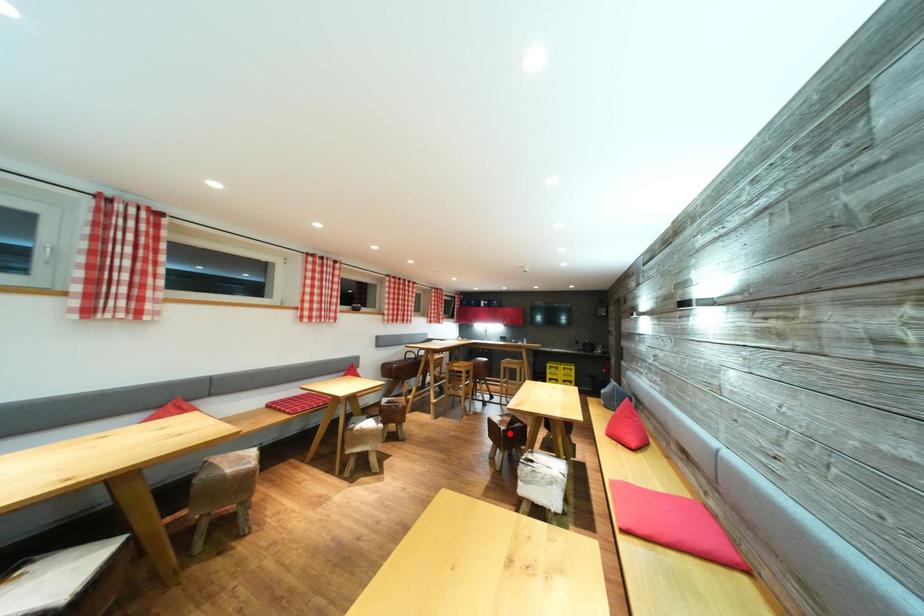
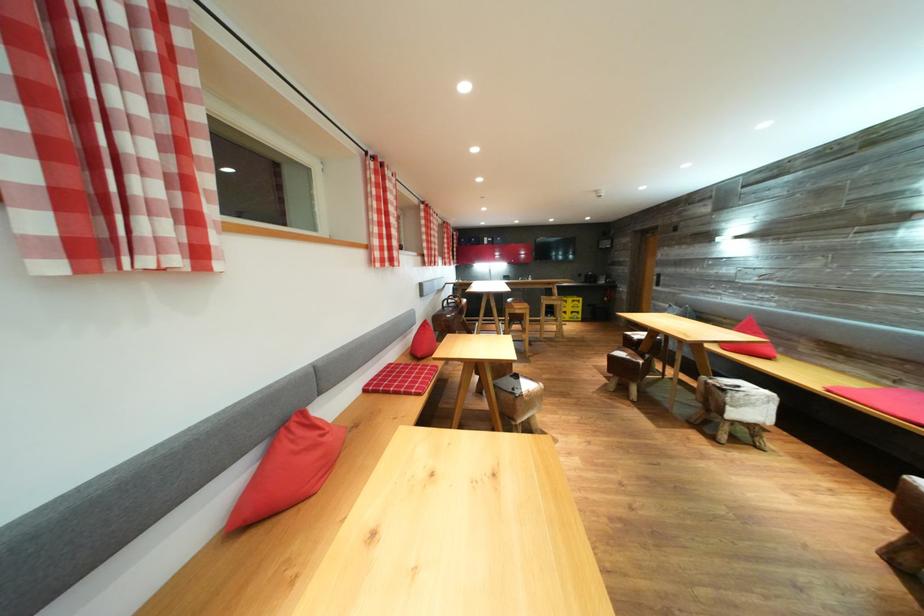
Find the pixel in the second image that matches the highlighted location in the first image.

(648, 367)